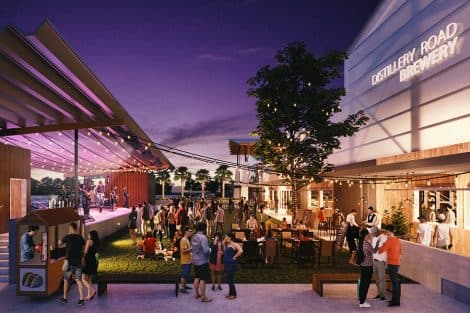
Find the location of `stage`. stage is located at coordinates (105, 213).